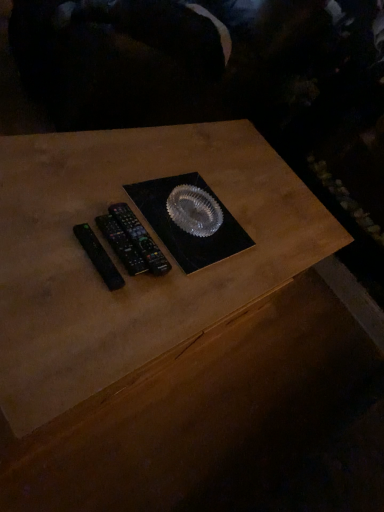
Question: Is black plastic remote controls at center, which is the 1th control from back to front, taller or shorter than black plastic remote at left, positioned as the second control in front-to-back order?

Choices:
 (A) tall
 (B) short

Answer: (A)

Question: Is black plastic remote controls at center, which is the 1th control from back to front, inside or outside of black plastic remote at left, positioned as the second control in front-to-back order?

Choices:
 (A) outside
 (B) inside

Answer: (A)

Question: Which object is positioned closest to the black plastic remote at left, positioned as the second control in front-to-back order?

Choices:
 (A) black plastic remote controls at center, acting as the 3th control starting from the front
 (B) black plastic remote at left, placed as the third control when sorted from back to front

Answer: (A)

Question: Estimate the real-world distances between objects in this image. Which object is closer to the black plastic remote at left, positioned as the second control in front-to-back order?

Choices:
 (A) black plastic remote controls at center, acting as the 3th control starting from the front
 (B) black plastic remote at left, the 1th control viewed from the front

Answer: (A)